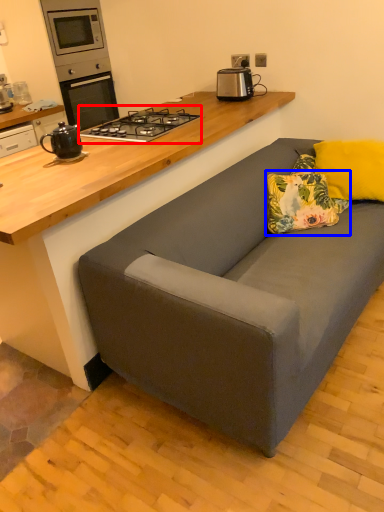
Question: Which of the following is the farthest to the observer, gas stove (highlighted by a red box) or pillow (highlighted by a blue box)?

Choices:
 (A) gas stove
 (B) pillow

Answer: (A)